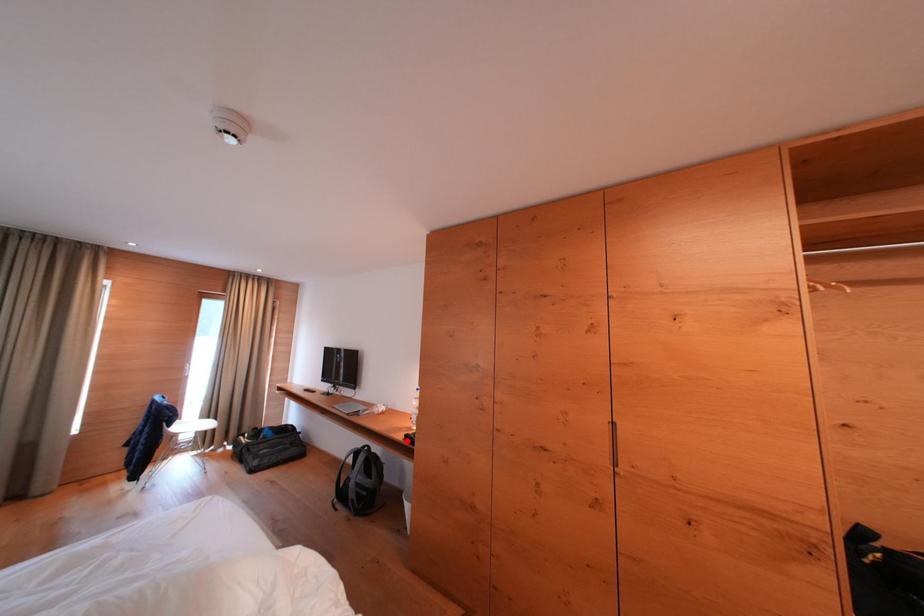
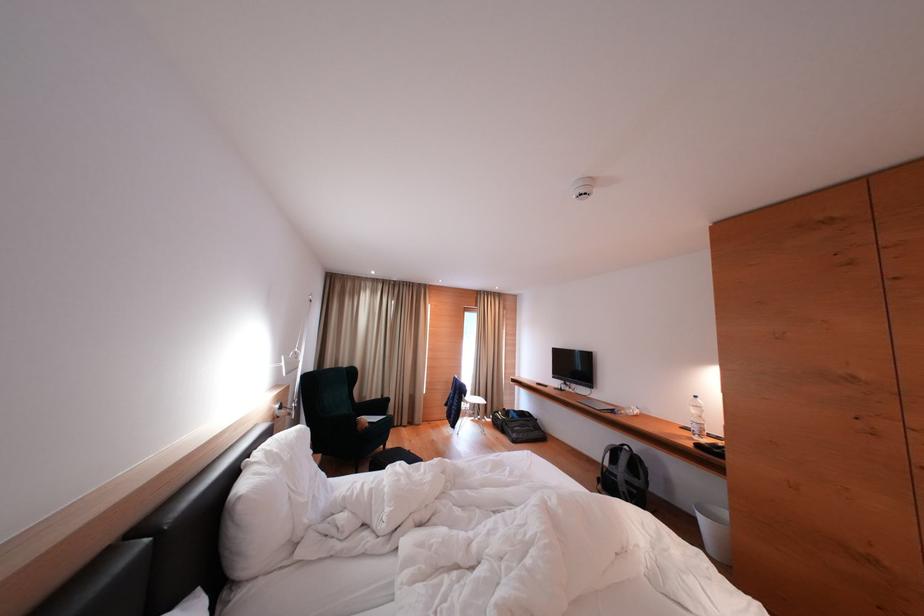
Question: I am providing you with two images of the same scene from different viewpoints. A red point is shown in image1. For the corresponding object point in image2, is it positioned nearer or farther from the camera?

Choices:
 (A) Nearer
 (B) Farther

Answer: (A)